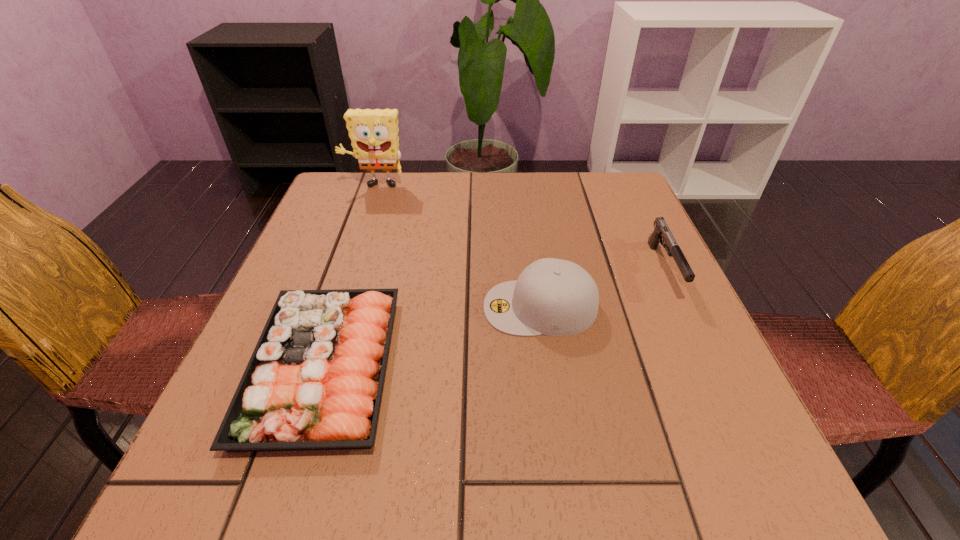
I want to click on vacant region that satisfies the following two spatial constraints: 1. on the face of the sponge; 2. on the left side of the shortest object, so click(314, 367).